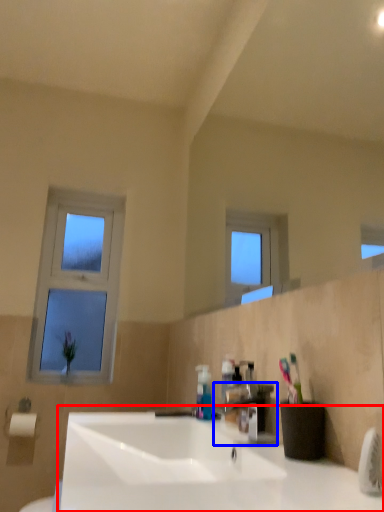
Question: Which point is closer to the camera, sink (highlighted by a red box) or tap (highlighted by a blue box)?

Choices:
 (A) sink
 (B) tap

Answer: (A)